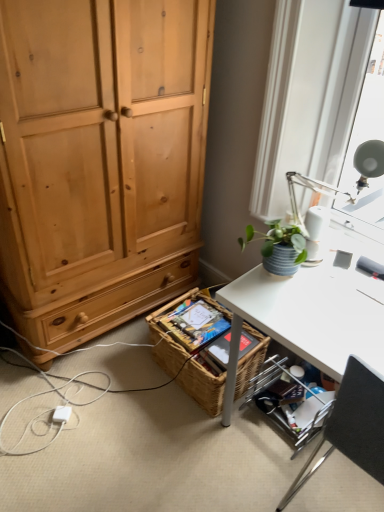
What do you see at coordinates (352, 425) in the screenshot? I see `black fabric chair at lower right` at bounding box center [352, 425].

You are a GUI agent. You are given a task and a screenshot of the screen. Output one action in this format:
    pyautogui.click(x=<x>, y=<y>)
    Task: Click on the metallic silver shelf at lower right
    The height and width of the screenshot is (512, 384).
    Given the screenshot: What is the action you would take?
    pyautogui.click(x=290, y=402)

Locate an element on the screen. This screenshot has width=384, height=512. woven brown picnic basket at lower center is located at coordinates (203, 387).

Is the surface of metallic silver shelf at lower right in direct contact with white plastic power outlet at lower left?

No, metallic silver shelf at lower right is not touching white plastic power outlet at lower left.

From the image's perspective, is metallic silver shelf at lower right located above white plastic power outlet at lower left?

Yes, from the image's perspective, metallic silver shelf at lower right is on top of white plastic power outlet at lower left.

Is metallic silver shelf at lower right closer to camera compared to white plastic power outlet at lower left?

Yes.

From a real-world perspective, is metallic silver shelf at lower right on top of white plastic power outlet at lower left?

Yes.

Could black fabric chair at lower right be considered to be inside metallic silver shelf at lower right?

Definitely not — black fabric chair at lower right is not inside metallic silver shelf at lower right.

From the image's perspective, does metallic silver shelf at lower right appear higher than black fabric chair at lower right?

No, from the image's perspective, metallic silver shelf at lower right is not above black fabric chair at lower right.

Is woven brown picnic basket at lower center in front of black fabric chair at lower right?

No, the depth of woven brown picnic basket at lower center is greater than that of black fabric chair at lower right.

From a real-world perspective, is woven brown picnic basket at lower center physically below black fabric chair at lower right?

Yes.

Between woven brown picnic basket at lower center and black fabric chair at lower right, which one has more height?

black fabric chair at lower right is taller.

Is woven brown picnic basket at lower center not close to black fabric chair at lower right?

No, woven brown picnic basket at lower center is not far away from black fabric chair at lower right.

Between white plastic power outlet at lower left and black fabric chair at lower right, which one has larger size?

Bigger between the two is black fabric chair at lower right.

Image resolution: width=384 pixels, height=512 pixels. I want to click on power outlet lying below the black fabric chair at lower right (from the image's perspective), so click(x=61, y=414).

From a real-world perspective, who is located lower, white plastic power outlet at lower left or black fabric chair at lower right?

white plastic power outlet at lower left.

Considering the positions of objects white plastic power outlet at lower left and black fabric chair at lower right in the image provided, who is more to the left, white plastic power outlet at lower left or black fabric chair at lower right?

From the viewer's perspective, white plastic power outlet at lower left appears more on the left side.

Does metallic silver shelf at lower right have a greater width compared to woven brown picnic basket at lower center?

Yes, metallic silver shelf at lower right is wider than woven brown picnic basket at lower center.

From the picture: Is metallic silver shelf at lower right to the right of woven brown picnic basket at lower center from the viewer's perspective?

Indeed, metallic silver shelf at lower right is positioned on the right side of woven brown picnic basket at lower center.

How much distance is there between metallic silver shelf at lower right and woven brown picnic basket at lower center?

metallic silver shelf at lower right and woven brown picnic basket at lower center are 9.71 inches apart from each other.

Is metallic silver shelf at lower right closer to camera compared to woven brown picnic basket at lower center?

That is True.

From the image's perspective, does black fabric chair at lower right appear lower than metallic silver shelf at lower right?

Actually, black fabric chair at lower right appears above metallic silver shelf at lower right in the image.

In the scene shown: Considering the sizes of black fabric chair at lower right and metallic silver shelf at lower right in the image, is black fabric chair at lower right wider or thinner than metallic silver shelf at lower right?

black fabric chair at lower right is wider than metallic silver shelf at lower right.

You are a GUI agent. You are given a task and a screenshot of the screen. Output one action in this format:
    pyautogui.click(x=<x>, y=<y>)
    Task: Click on the shelf located on the left of black fabric chair at lower right
    Image resolution: width=384 pixels, height=512 pixels.
    Given the screenshot: What is the action you would take?
    pyautogui.click(x=290, y=402)

From their relative heights in the image, would you say black fabric chair at lower right is taller or shorter than metallic silver shelf at lower right?

Considering their sizes, black fabric chair at lower right has more height than metallic silver shelf at lower right.

Find the location of a particular element. The width and height of the screenshot is (384, 512). picnic basket below the black fabric chair at lower right (from a real-world perspective) is located at coordinates (203, 387).

Does black fabric chair at lower right have a lesser height compared to woven brown picnic basket at lower center?

No, black fabric chair at lower right is not shorter than woven brown picnic basket at lower center.

Considering the sizes of objects black fabric chair at lower right and woven brown picnic basket at lower center in the image provided, who is bigger, black fabric chair at lower right or woven brown picnic basket at lower center?

With larger size is black fabric chair at lower right.

Which is behind, point (299, 489) or point (258, 344)?

Positioned behind is point (258, 344).

Locate an element on the screen. power outlet below the metallic silver shelf at lower right (from a real-world perspective) is located at coordinates (61, 414).

In order to click on shelf on the left of the black fabric chair at lower right in this screenshot , I will do click(x=290, y=402).

Considering their positions, is black fabric chair at lower right positioned further to white plastic power outlet at lower left than woven brown picnic basket at lower center?

black fabric chair at lower right is further to white plastic power outlet at lower left.

From the image, which object appears to be nearer to metallic silver shelf at lower right, woven brown picnic basket at lower center or black fabric chair at lower right?

woven brown picnic basket at lower center.

Based on their spatial positions, is white plastic power outlet at lower left or metallic silver shelf at lower right further from black fabric chair at lower right?

white plastic power outlet at lower left is further to black fabric chair at lower right.

Which object lies further to the anchor point white plastic power outlet at lower left, metallic silver shelf at lower right or woven brown picnic basket at lower center?

Based on the image, metallic silver shelf at lower right appears to be further to white plastic power outlet at lower left.

When comparing their distances from black fabric chair at lower right, does white plastic power outlet at lower left or woven brown picnic basket at lower center seem closer?

woven brown picnic basket at lower center.

In the scene shown: Based on their spatial positions, is black fabric chair at lower right or woven brown picnic basket at lower center further from metallic silver shelf at lower right?

Among the two, black fabric chair at lower right is located further to metallic silver shelf at lower right.

Based on the photo, which object lies nearer to the anchor point black fabric chair at lower right, woven brown picnic basket at lower center or metallic silver shelf at lower right?

metallic silver shelf at lower right.

From the image, which object appears to be nearer to metallic silver shelf at lower right, black fabric chair at lower right or white plastic power outlet at lower left?

black fabric chair at lower right.

Where is `shelf situated between white plastic power outlet at lower left and black fabric chair at lower right from left to right`? The image size is (384, 512). shelf situated between white plastic power outlet at lower left and black fabric chair at lower right from left to right is located at coordinates (290, 402).

Identify the location of picnic basket between white plastic power outlet at lower left and metallic silver shelf at lower right in the horizontal direction. The width and height of the screenshot is (384, 512). (203, 387).

Where is `shelf between black fabric chair at lower right and woven brown picnic basket at lower center in the front-back direction`? The height and width of the screenshot is (512, 384). shelf between black fabric chair at lower right and woven brown picnic basket at lower center in the front-back direction is located at coordinates (290, 402).

At what (x,y) coordinates should I click in order to perform the action: click on picnic basket located between white plastic power outlet at lower left and black fabric chair at lower right in the left-right direction. Please return your answer as a coordinate pair (x, y). This screenshot has height=512, width=384. Looking at the image, I should click on (203, 387).